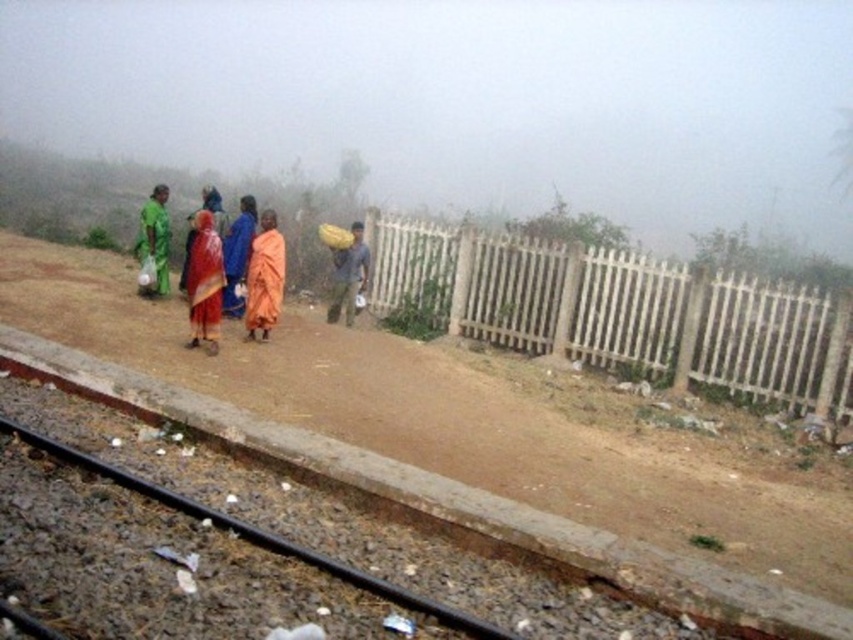
Is matte orange cloth at center to the left of brown fabric bag at center from the viewer's perspective?

Yes, matte orange cloth at center is to the left of brown fabric bag at center.

How far apart are matte orange cloth at center and brown fabric bag at center?

2.48 meters

This screenshot has height=640, width=853. Identify the location of matte orange cloth at center. (204, 282).

Does black rubber track at lower left appear under matte orange cloth at center?

Correct, black rubber track at lower left is located below matte orange cloth at center.

Who is shorter, black rubber track at lower left or matte orange cloth at center?

With less height is black rubber track at lower left.

Image resolution: width=853 pixels, height=640 pixels. I want to click on black rubber track at lower left, so click(x=260, y=536).

Does point (489, 624) come closer to viewer compared to point (350, 262)?

Yes, point (489, 624) is closer to viewer.

Which is behind, point (102, 472) or point (334, 304)?

Positioned behind is point (334, 304).

Find the location of a particular element. This screenshot has height=640, width=853. black rubber track at lower left is located at coordinates (260, 536).